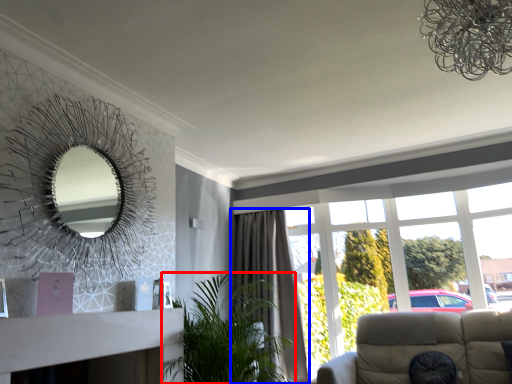
Question: Which point is closer to the camera, houseplant (highlighted by a red box) or curtain (highlighted by a blue box)?

Choices:
 (A) houseplant
 (B) curtain

Answer: (A)